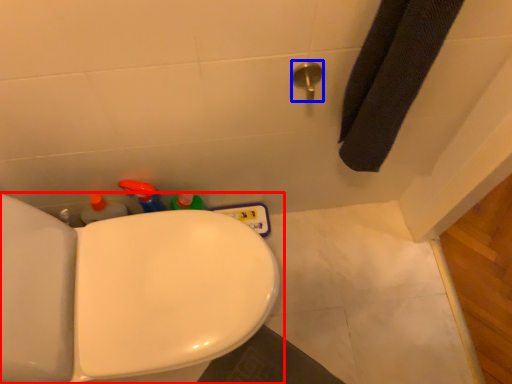
Question: Which object appears closest to the camera in this image, toilet (highlighted by a red box) or shower (highlighted by a blue box)?

Choices:
 (A) toilet
 (B) shower

Answer: (A)